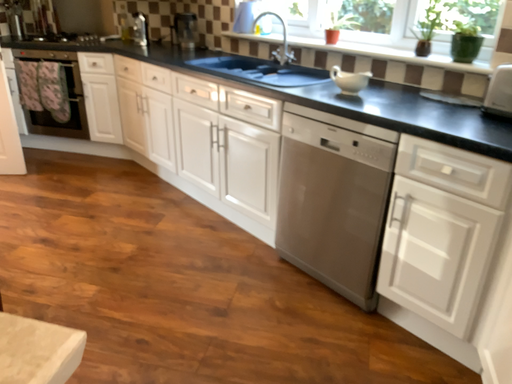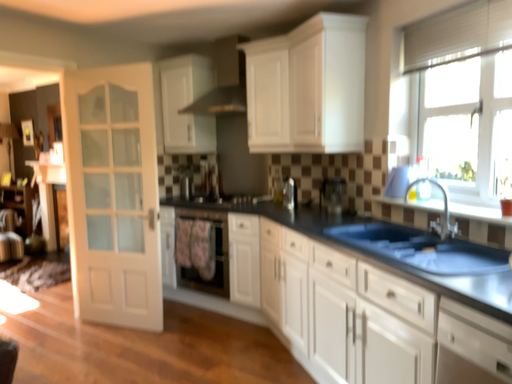
Question: How did the camera likely rotate when shooting the video?

Choices:
 (A) rotated downward
 (B) rotated upward

Answer: (B)